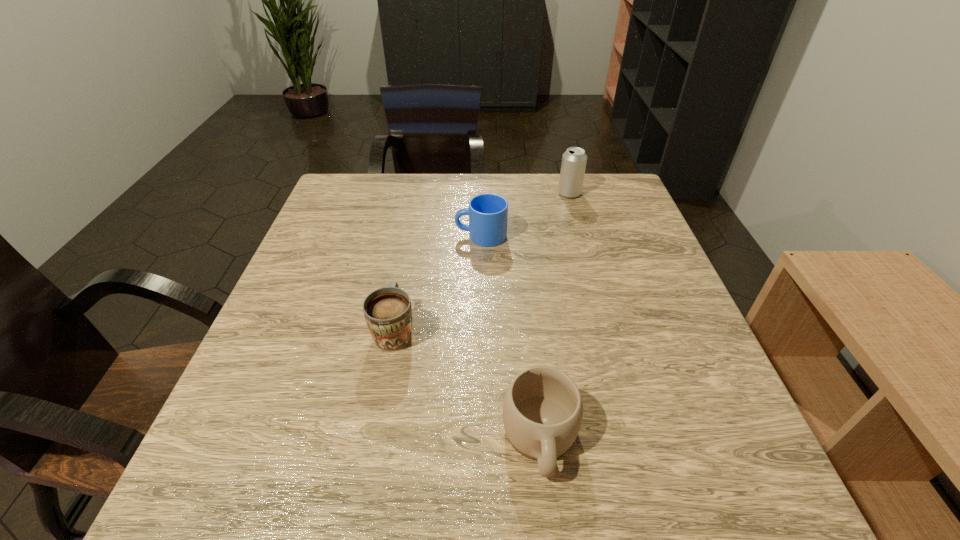
Identify the location of beer can. (574, 160).

Where is `the rightmost object`? The height and width of the screenshot is (540, 960). the rightmost object is located at coordinates (574, 160).

Find the location of a particular element. The width and height of the screenshot is (960, 540). the farthest mug is located at coordinates (488, 213).

Find the location of a particular element. The width and height of the screenshot is (960, 540). the nearest mug is located at coordinates (542, 411).

I want to click on the leftmost object, so click(388, 313).

Where is `the third farthest object`? Image resolution: width=960 pixels, height=540 pixels. the third farthest object is located at coordinates (388, 313).

Locate an element on the screen. This screenshot has height=540, width=960. free region located on the left of the beer can is located at coordinates (442, 193).

Where is `vacant space located 0.140m on the side of the second farthest object with the handle`? The image size is (960, 540). vacant space located 0.140m on the side of the second farthest object with the handle is located at coordinates (399, 236).

Locate an element on the screen. free location located 0.170m on the side of the second farthest object with the handle is located at coordinates (387, 236).

Locate an element on the screen. Image resolution: width=960 pixels, height=540 pixels. free region located 0.270m on the side of the second farthest object with the handle is located at coordinates (348, 236).